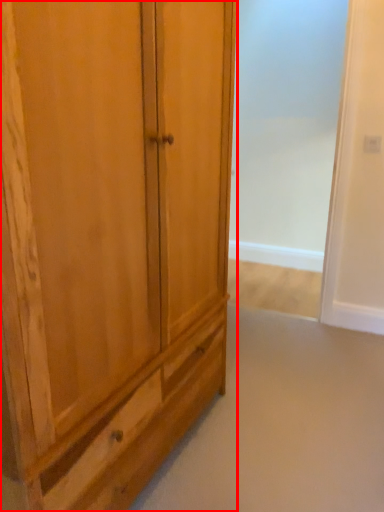
Question: From the image's perspective, considering the relative positions of cupboard (annotated by the red box) and screen door in the image provided, where is cupboard (annotated by the red box) located with respect to the staircase?

Choices:
 (A) below
 (B) above

Answer: (A)